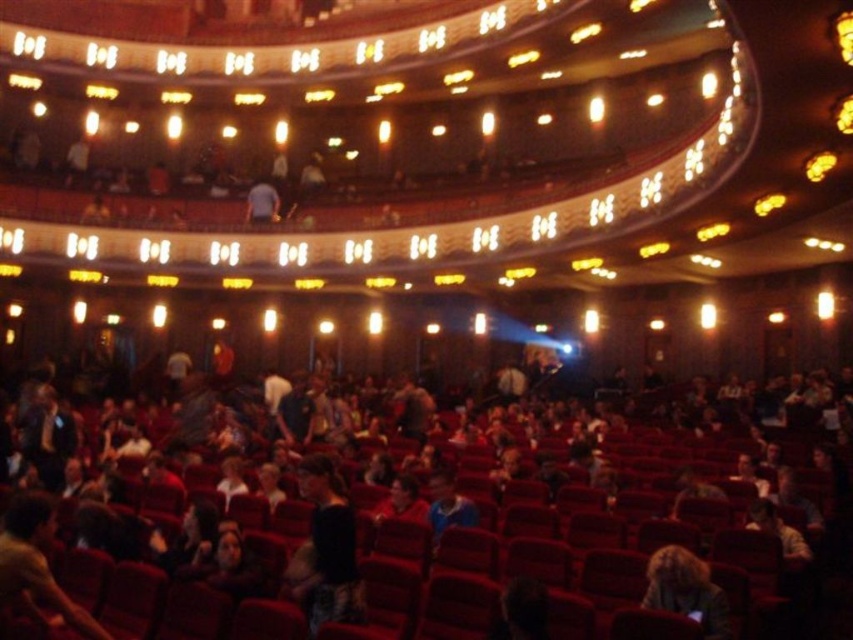
Question: Is dark brown leather jacket at center thinner than blonde hair at lower right?

Choices:
 (A) no
 (B) yes

Answer: (A)

Question: In this image, where is dark brown leather jacket at center located relative to blonde hair at lower right?

Choices:
 (A) above
 (B) below

Answer: (A)

Question: Does dark brown leather jacket at center appear over black fabric at center?

Choices:
 (A) no
 (B) yes

Answer: (B)

Question: Which point is closer to the camera taking this photo?

Choices:
 (A) click(x=759, y=582)
 (B) click(x=665, y=550)

Answer: (B)

Question: Among these objects, which one is nearest to the camera?

Choices:
 (A) blonde hair at lower right
 (B) black fabric at center

Answer: (A)

Question: Considering the real-world distances, which object is farthest from the black fabric at center?

Choices:
 (A) blonde hair at lower right
 (B) dark brown leather jacket at center

Answer: (A)